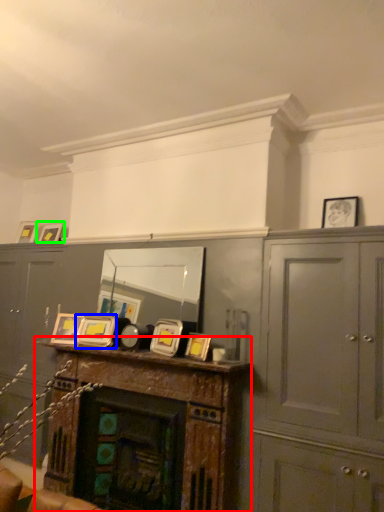
Question: Which object is positioned closest to table (highlighted by a red box)? Select from picture frame (highlighted by a blue box) and picture frame (highlighted by a green box).

Choices:
 (A) picture frame
 (B) picture frame

Answer: (A)